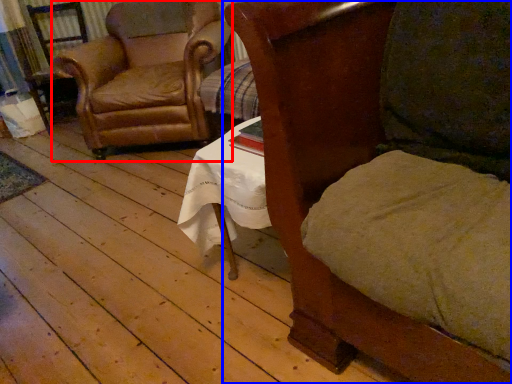
Question: Which of the following is the closest to the observer, chair (highlighted by a red box) or chair (highlighted by a blue box)?

Choices:
 (A) chair
 (B) chair

Answer: (B)